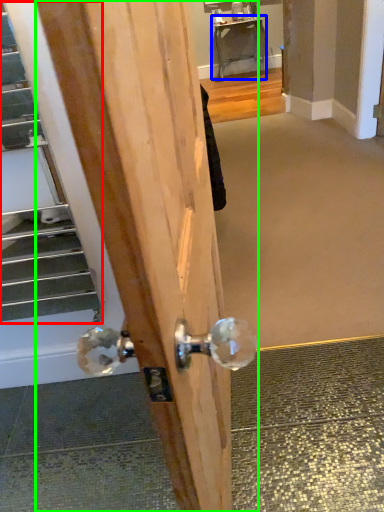
Question: Estimate the real-world distances between objects in this image. Which object is closer to escalator (highlighted by a red box), table (highlighted by a blue box) or door (highlighted by a green box)?

Choices:
 (A) table
 (B) door

Answer: (B)